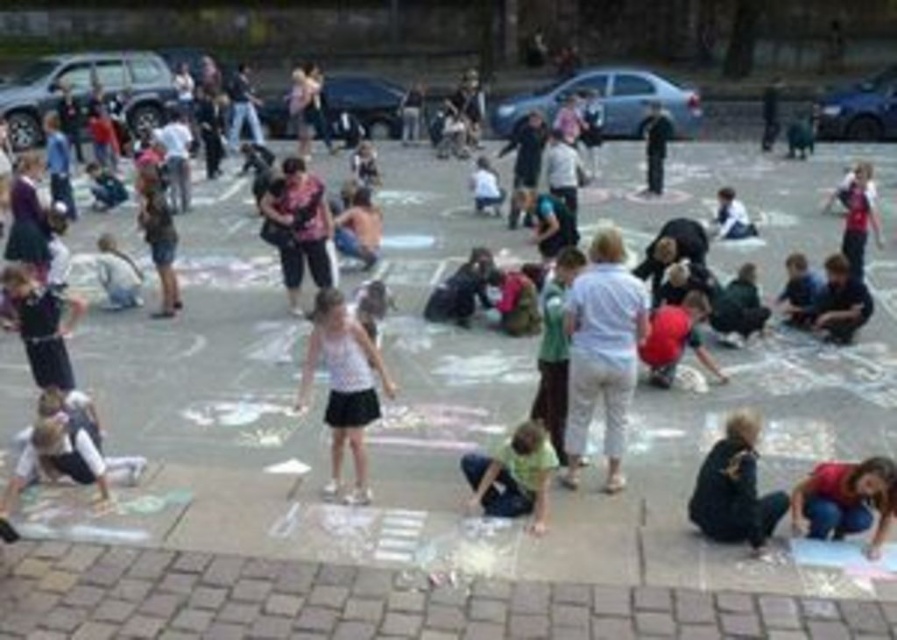
Who is positioned more to the left, white cotton shirt at center or green cotton shirt at lower center?

From the viewer's perspective, green cotton shirt at lower center appears more on the left side.

Does white cotton shirt at center appear under green cotton shirt at lower center?

Incorrect, white cotton shirt at center is not positioned below green cotton shirt at lower center.

Identify the location of white cotton shirt at center. The image size is (897, 640). (602, 352).

The height and width of the screenshot is (640, 897). In order to click on white cotton shirt at center in this screenshot , I will do `click(602, 352)`.

Is dark brown leather jacket at lower right positioned in front of green cotton shirt at lower center?

That is True.

Does dark brown leather jacket at lower right have a larger size compared to green cotton shirt at lower center?

Incorrect, dark brown leather jacket at lower right is not larger than green cotton shirt at lower center.

I want to click on dark brown leather jacket at lower right, so click(x=734, y=486).

You are a GUI agent. You are given a task and a screenshot of the screen. Output one action in this format:
    pyautogui.click(x=<x>, y=<y>)
    Task: Click on the dark brown leather jacket at lower right
    The height and width of the screenshot is (640, 897).
    Given the screenshot: What is the action you would take?
    734,486

Consider the image. Is white cotton shirt at center taller than white matte tank top at center?

Indeed, white cotton shirt at center has a greater height compared to white matte tank top at center.

The image size is (897, 640). I want to click on white cotton shirt at center, so coord(602,352).